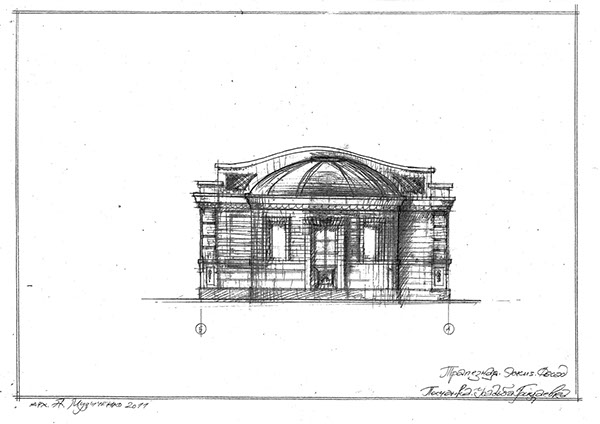
Identify the location of window. (277, 241), (367, 238).